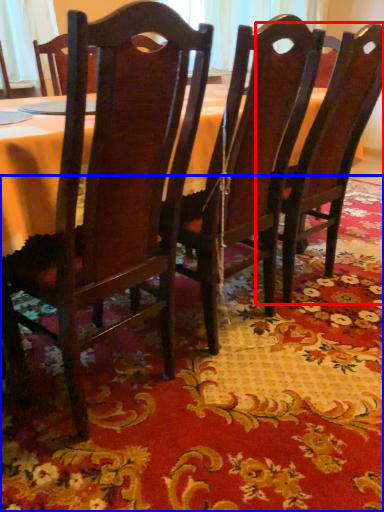
Question: Which point is closer to the camera, chair (highlighted by a red box) or place mat (highlighted by a blue box)?

Choices:
 (A) chair
 (B) place mat

Answer: (B)